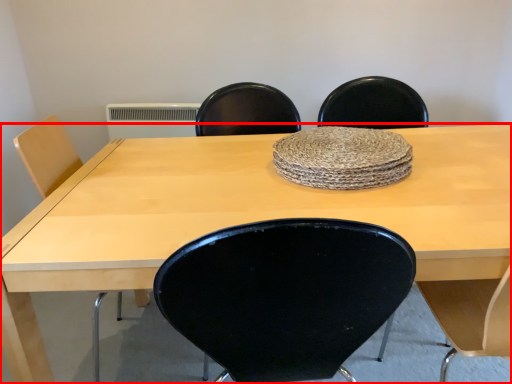
Question: From the image's perspective, what is the correct spatial relationship of table (annotated by the red box) in relation to mat?

Choices:
 (A) below
 (B) above

Answer: (A)